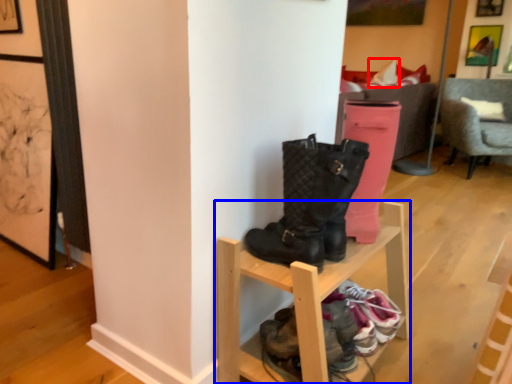
Question: Among these objects, which one is nearest to the camera, pillow (highlighted by a red box) or shelf (highlighted by a blue box)?

Choices:
 (A) pillow
 (B) shelf

Answer: (B)